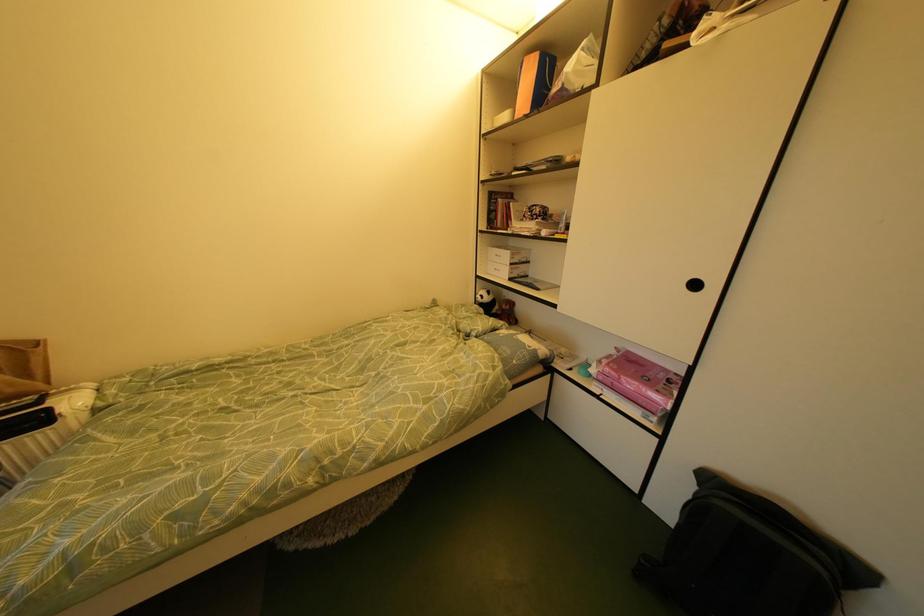
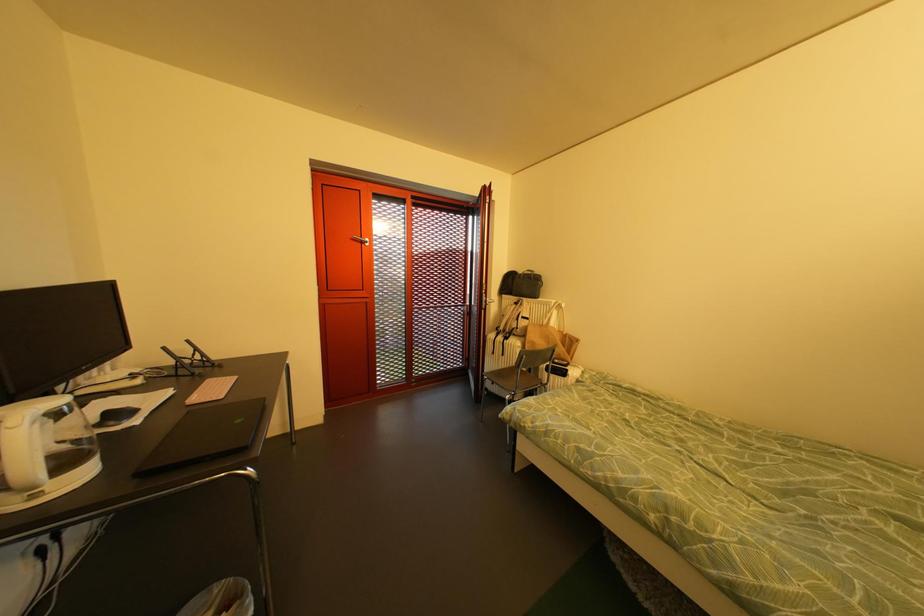
Question: The camera is either moving clockwise (left) or counter-clockwise (right) around the object. The first image is from the beginning of the video and the second image is from the end. Is the camera moving left or right when shooting the video?

Choices:
 (A) Left
 (B) Right

Answer: (B)